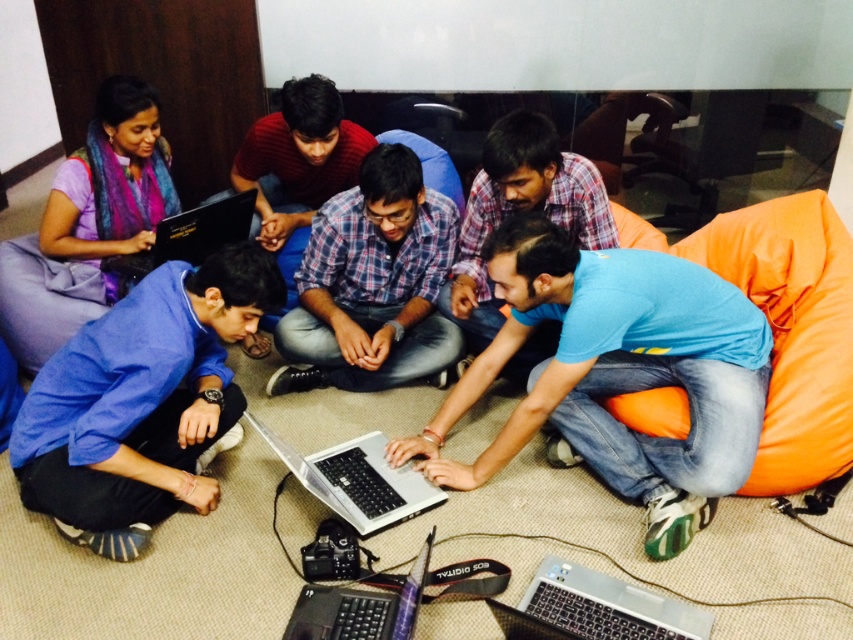
Question: From the image, what is the correct spatial relationship of silver metallic laptop at lower center in relation to black matte laptop at lower center?

Choices:
 (A) above
 (B) below

Answer: (B)

Question: Can you confirm if silver metallic laptop at lower center is wider than black glossy laptop at upper left?

Choices:
 (A) yes
 (B) no

Answer: (B)

Question: Among these objects, which one is farthest from the camera?

Choices:
 (A) blue fabric pants at lower left
 (B) black matte laptop at lower center
 (C) blue matte shirt at center
 (D) silver metallic laptop at center

Answer: (D)

Question: Is blue matte shirt at center to the left of plaid cotton shirt at center from the viewer's perspective?

Choices:
 (A) no
 (B) yes

Answer: (A)

Question: Which object is farther from the camera taking this photo?

Choices:
 (A) black glossy laptop at upper left
 (B) plaid fabric shirt at center

Answer: (B)

Question: Which object is farther from the camera taking this photo?

Choices:
 (A) blue fabric pants at lower left
 (B) blue plaid shirt at center
 (C) silver metallic laptop at center

Answer: (B)